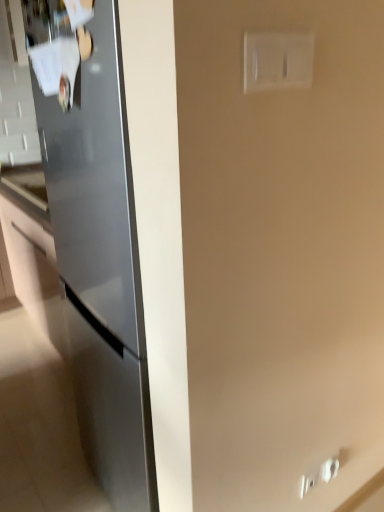
Question: Is white plastic switch at upper right inside the boundaries of sleek metallic refrigerator at left, or outside?

Choices:
 (A) inside
 (B) outside

Answer: (B)

Question: Considering the relative positions of white plastic switch at upper right and sleek metallic refrigerator at left in the image provided, is white plastic switch at upper right to the left or to the right of sleek metallic refrigerator at left?

Choices:
 (A) left
 (B) right

Answer: (B)

Question: From their relative heights in the image, would you say white plastic switch at upper right is taller or shorter than sleek metallic refrigerator at left?

Choices:
 (A) short
 (B) tall

Answer: (A)

Question: From the image's perspective, relative to white plastic switch at upper right, is sleek metallic refrigerator at left above or below?

Choices:
 (A) above
 (B) below

Answer: (B)

Question: Looking at the image, does sleek metallic refrigerator at left seem bigger or smaller compared to white plastic switch at upper right?

Choices:
 (A) big
 (B) small

Answer: (A)

Question: Based on their positions, is sleek metallic refrigerator at left located to the left or right of white plastic switch at upper right?

Choices:
 (A) right
 (B) left

Answer: (B)

Question: Relative to white plastic switch at upper right, is sleek metallic refrigerator at left in front or behind?

Choices:
 (A) behind
 (B) front

Answer: (A)